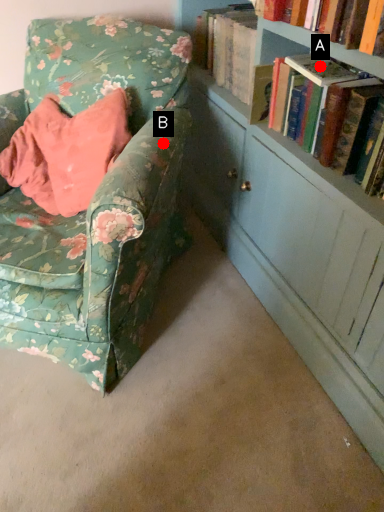
Question: Two points are circled on the image, labeled by A and B beside each circle. Among these points, which one is farthest from the camera?

Choices:
 (A) A is further
 (B) B is further

Answer: (B)